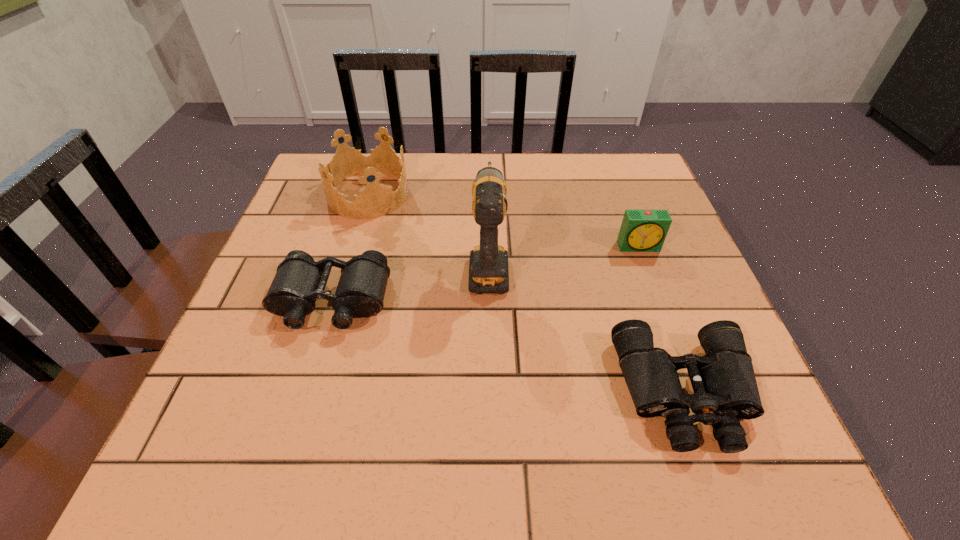
In order to click on unoccupied area between the nearer binoculars and the third tallest object in this screenshot , I will do `click(662, 320)`.

Find the location of a particular element. free space between the left binoculars and the fourth shortest object is located at coordinates (349, 248).

Find the location of `vacant area between the alarm clock and the tallest object`. vacant area between the alarm clock and the tallest object is located at coordinates (564, 256).

Where is `free space between the third object from right to left and the third tallest object`? The image size is (960, 540). free space between the third object from right to left and the third tallest object is located at coordinates (564, 256).

Image resolution: width=960 pixels, height=540 pixels. In order to click on free space that is in between the nearest object and the farthest object in this screenshot , I will do `click(527, 294)`.

At what (x,y) coordinates should I click in order to perform the action: click on vacant space that is in between the left binoculars and the tallest object. Please return your answer as a coordinate pair (x, y). This screenshot has height=540, width=960. Looking at the image, I should click on (410, 284).

Where is `free space between the tiara and the nearest object`? This screenshot has width=960, height=540. free space between the tiara and the nearest object is located at coordinates (527, 294).

The image size is (960, 540). Find the location of `free space between the right binoculars and the alarm clock`. free space between the right binoculars and the alarm clock is located at coordinates (662, 320).

Locate an element on the screen. This screenshot has width=960, height=540. vacant area that lies between the farthest object and the tallest object is located at coordinates (428, 230).

Select which object is the fourth closest to the third tallest object. Please provide its 2D coordinates. Your answer should be formatted as a tuple, i.e. [(x, y)], where the tuple contains the x and y coordinates of a point satisfying the conditions above.

[(375, 200)]